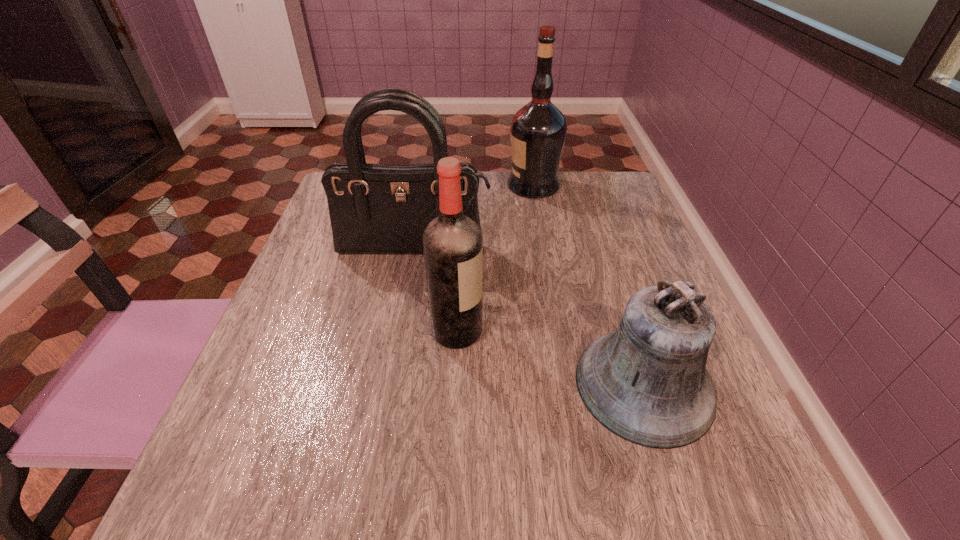
I want to click on free space between the nearer liquor and the shortest object, so [x=550, y=358].

The height and width of the screenshot is (540, 960). I want to click on vacant point located between the third nearest object and the bell, so click(529, 318).

At what (x,y) coordinates should I click in order to perform the action: click on free space between the shortest object and the handbag. Please return your answer as a coordinate pair (x, y). The image size is (960, 540). Looking at the image, I should click on (529, 318).

You are a GUI agent. You are given a task and a screenshot of the screen. Output one action in this format:
    pyautogui.click(x=<x>, y=<y>)
    Task: Click on the vacant space that's between the nearer liquor and the bell
    
    Given the screenshot: What is the action you would take?
    pyautogui.click(x=550, y=358)

This screenshot has height=540, width=960. In order to click on object that is the third nearest to the left liquor in this screenshot , I will do `click(538, 130)`.

Locate which object ranks third in proximity to the farthest object. Please provide its 2D coordinates. Your answer should be formatted as a tuple, i.e. [(x, y)], where the tuple contains the x and y coordinates of a point satisfying the conditions above.

[(647, 382)]

In order to click on vacant area that satisfies the following two spatial constraints: 1. on the back side of the bell; 2. on the front-facing side of the nearer liquor in this screenshot , I will do `click(627, 332)`.

I want to click on vacant area that satisfies the following two spatial constraints: 1. on the front-facing side of the bell; 2. on the left side of the left liquor, so click(454, 384).

What are the coordinates of `free space that satisfies the following two spatial constraints: 1. on the surface of the right liquor; 2. with an open clasp on the front of the handbag` in the screenshot? It's located at (545, 250).

The width and height of the screenshot is (960, 540). Find the location of `free point that satisfies the following two spatial constraints: 1. on the surface of the farther liquor; 2. on the right side of the shortest object`. free point that satisfies the following two spatial constraints: 1. on the surface of the farther liquor; 2. on the right side of the shortest object is located at coordinates [568, 384].